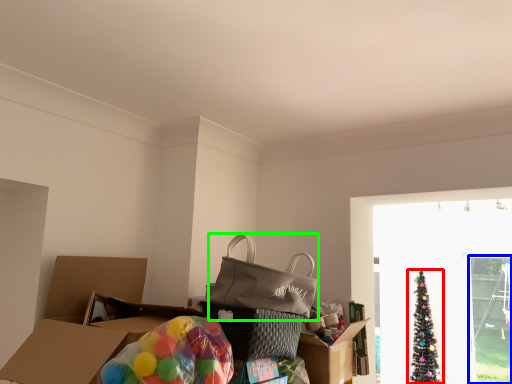
Question: Which is farther away from christmas tree (highlighted by a red box)? screen door (highlighted by a blue box) or pack (highlighted by a green box)?

Choices:
 (A) screen door
 (B) pack

Answer: (B)